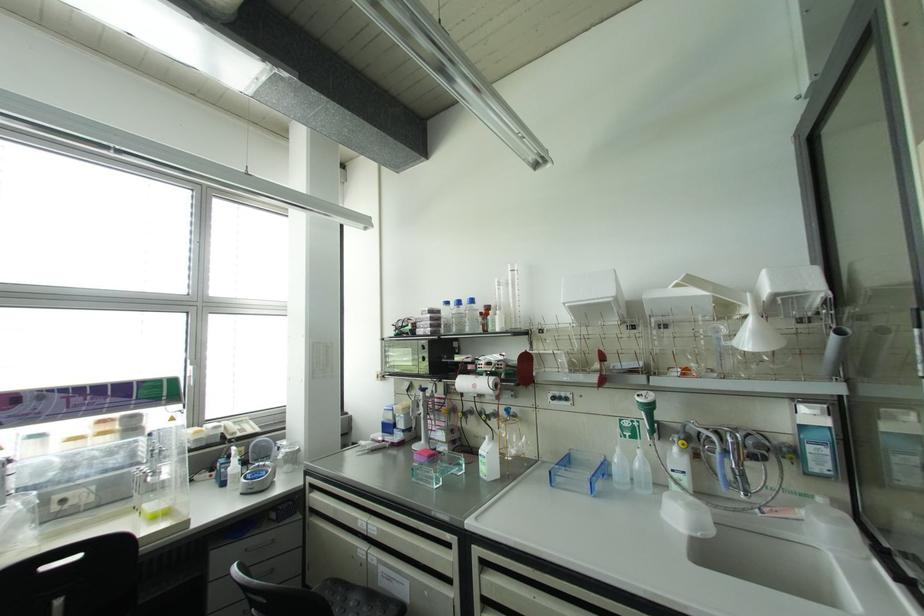
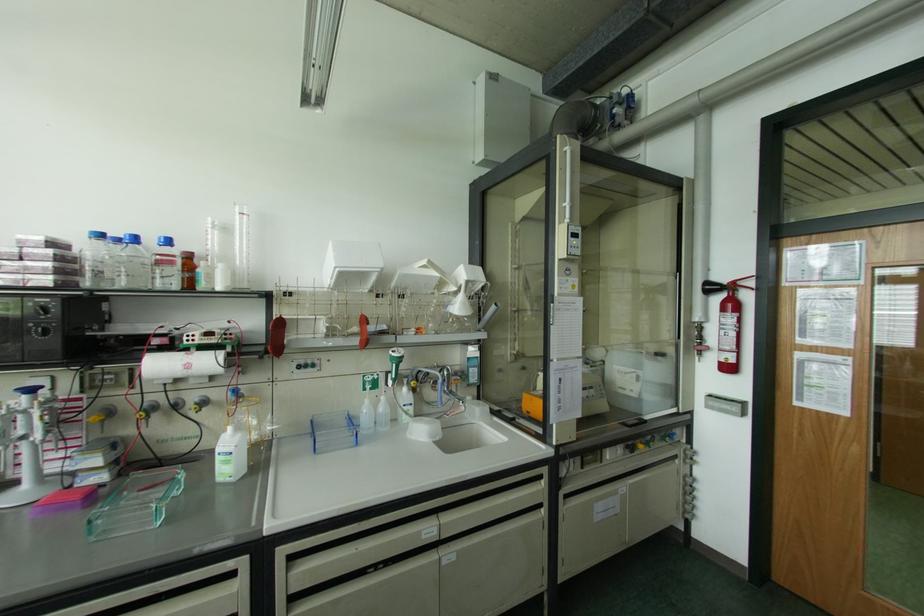
Question: The camera is either moving clockwise (left) or counter-clockwise (right) around the object. The first image is from the beginning of the video and the second image is from the end. Is the camera moving left or right when shooting the video?

Choices:
 (A) Left
 (B) Right

Answer: (A)